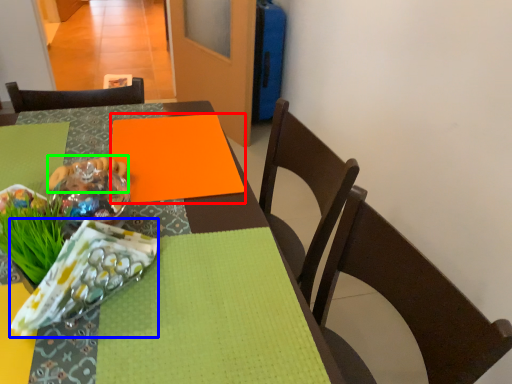
Question: Which object is positioned farthest from linen (highlighted by a red box)? Select from material (highlighted by a blue box) and food (highlighted by a green box).

Choices:
 (A) material
 (B) food

Answer: (A)